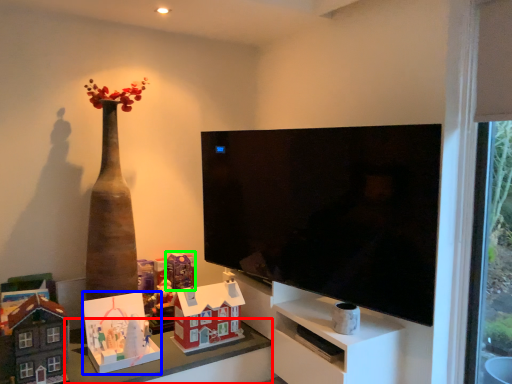
Question: Which object is the closest to the table (highlighted by a red box)? Choose among these: toy (highlighted by a blue box) or toy (highlighted by a green box).

Choices:
 (A) toy
 (B) toy

Answer: (A)